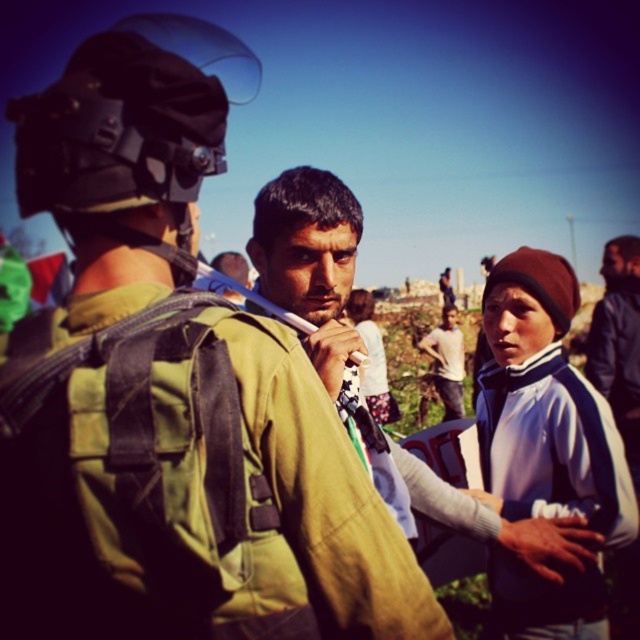
Question: Is matte green uniform at center above blue fleece jacket at right?

Choices:
 (A) no
 (B) yes

Answer: (B)

Question: Does blue fleece jacket at right appear over white fleece jacket at center?

Choices:
 (A) no
 (B) yes

Answer: (A)

Question: Which point is farther from the camera taking this photo?

Choices:
 (A) (192, 77)
 (B) (460, 342)
 (C) (518, 355)

Answer: (B)

Question: From the image, what is the correct spatial relationship of blue fleece jacket at right in relation to white fleece jacket at center?

Choices:
 (A) above
 (B) below

Answer: (B)

Question: Which object is the closest to the blue fleece jacket at right?

Choices:
 (A) white fleece jacket at center
 (B) matte green uniform at center

Answer: (A)

Question: Estimate the real-world distances between objects in this image. Which object is closer to the blue fleece jacket at right?

Choices:
 (A) white fleece jacket at center
 (B) matte green uniform at center

Answer: (A)